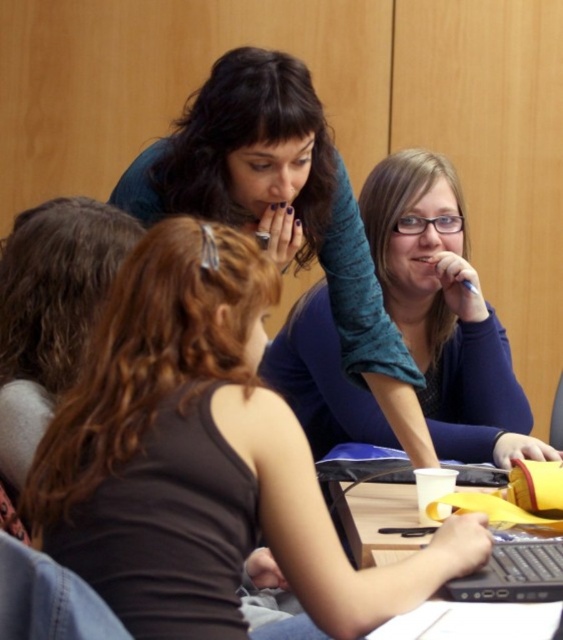
Can you confirm if brown hair at upper left is positioned above wooden table at center?

Yes.

Measure the distance between brown hair at upper left and wooden table at center.

A: brown hair at upper left and wooden table at center are 30.74 inches apart from each other.

Is point (46, 276) farther from camera compared to point (401, 518)?

No, (46, 276) is closer to viewer.

The width and height of the screenshot is (563, 640). In order to click on brown hair at upper left in this screenshot , I will do pos(51,310).

Is teal sweater at center smaller than wooden table at center?

Actually, teal sweater at center might be larger than wooden table at center.

Can you confirm if teal sweater at center is shorter than wooden table at center?

No.

Where is `teal sweater at center`? This screenshot has height=640, width=563. teal sweater at center is located at coordinates (283, 209).

Does matte blue shirt at center appear on the right side of wooden table at center?

Incorrect, matte blue shirt at center is not on the right side of wooden table at center.

Is matte blue shirt at center further to the viewer compared to wooden table at center?

A: No, it is not.

What do you see at coordinates (203, 458) in the screenshot? The image size is (563, 640). I see `matte blue shirt at center` at bounding box center [203, 458].

Where is `matte blue shirt at center`? Image resolution: width=563 pixels, height=640 pixels. matte blue shirt at center is located at coordinates (203, 458).